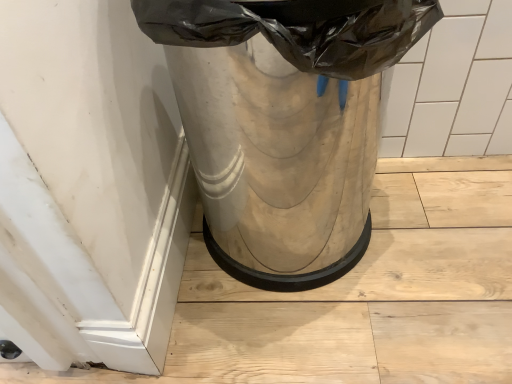
Describe the element at coordinates (283, 124) in the screenshot. I see `brushed metal trash can at lower center` at that location.

At what (x,y) coordinates should I click in order to perform the action: click on brushed metal trash can at lower center. Please return your answer as a coordinate pair (x, y). The height and width of the screenshot is (384, 512). Looking at the image, I should click on click(283, 124).

What is the approximate height of brushed metal trash can at lower center?

It is 59.17 centimeters.

You are a GUI agent. You are given a task and a screenshot of the screen. Output one action in this format:
    pyautogui.click(x=<x>, y=<y>)
    Task: Click on the brushed metal trash can at lower center
    This screenshot has height=384, width=512.
    Given the screenshot: What is the action you would take?
    pyautogui.click(x=283, y=124)